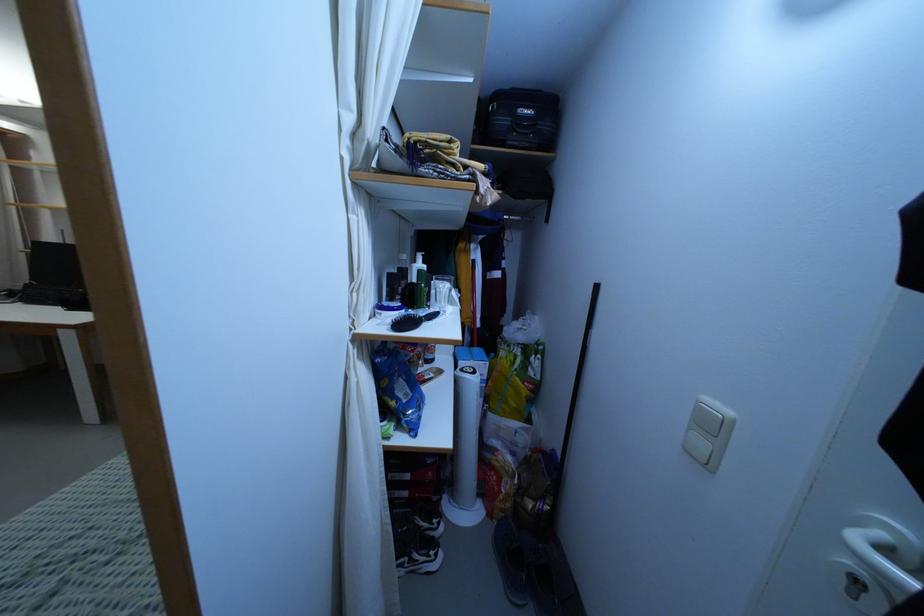
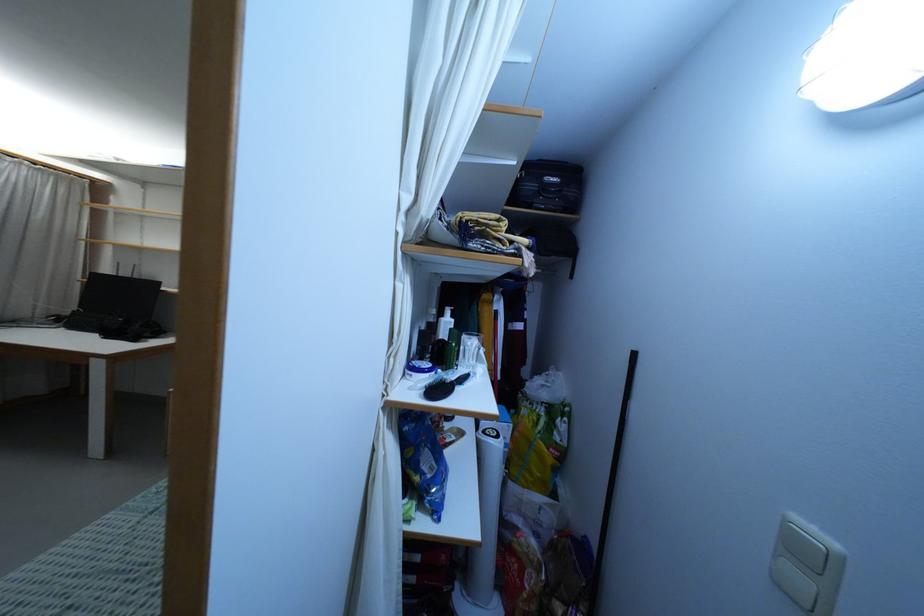
Find the pixel in the second image that matches pixel 397 399 in the first image.

(422, 474)